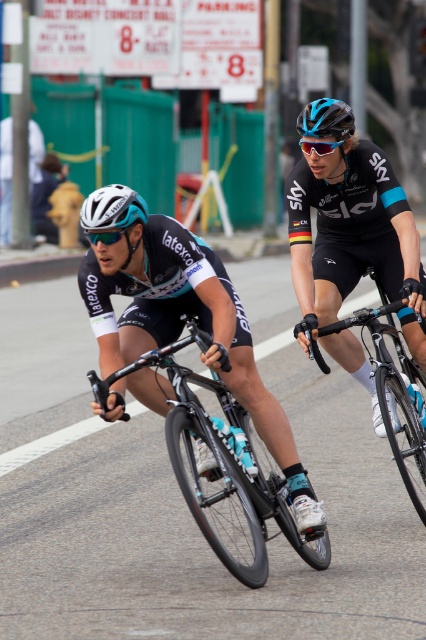
You are a drone operator trying to capture aerial footage of the cyclists during the race. Your drone is currently positioned above the point at coordinates point (x=86, y=216) and point (x=342, y=120). To ensure the best shot, you need to determine which point is closer to the camera. Which point should you focus on?

Point (x=86, y=216) is in front of point (x=342, y=120), so you should focus on point (x=86, y=216) as it is closer to the camera.

You are a photographer trying to capture a closeup shot of both the white matte bicycle helmet at left and the blue matte bicycle helmet at upper center. Given that your camera has a maximum focus range of 1.5 meters, can you capture both helmets in a single shot without moving the camera?

The white matte bicycle helmet at left is 1.59 meters from the blue matte bicycle helmet at upper center. Since the distance between them exceeds the camera maximum focus range of 1.5 meters, you cannot capture both helmets in a single shot without moving the camera.

You are a photographer trying to capture both the matte black bicycle at center and the white matte bicycle helmet at left in a single shot. Given their height difference, which object will you need to adjust your camera angle upwards to include in the frame?

The matte black bicycle at center is much taller than the white matte bicycle helmet at left, so you will need to adjust your camera angle upwards to include the matte black bicycle at center in the frame.